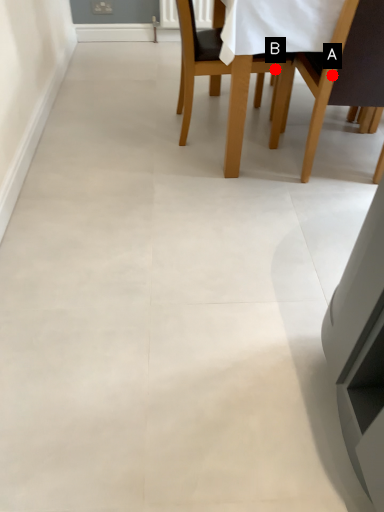
Question: Two points are circled on the image, labeled by A and B beside each circle. Which point is farther to the camera?

Choices:
 (A) A is further
 (B) B is further

Answer: (B)